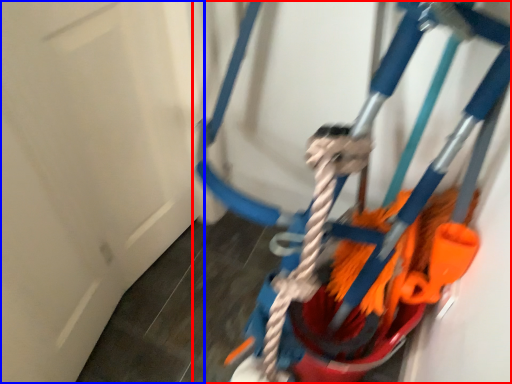
Question: Which object appears farthest to the camera in this image, toy (highlighted by a red box) or door (highlighted by a blue box)?

Choices:
 (A) toy
 (B) door

Answer: (A)